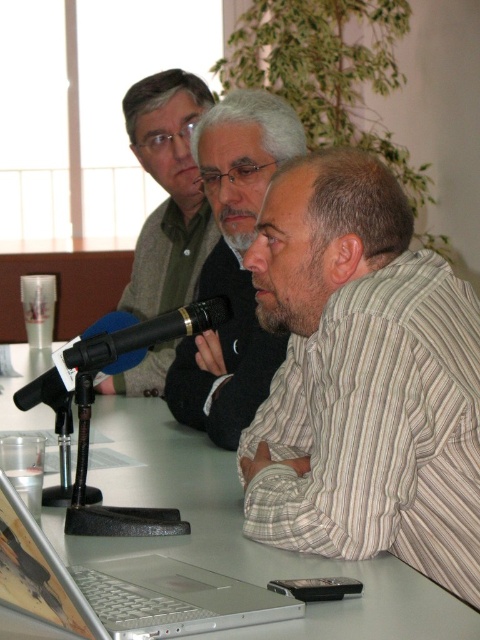
Based on the photo, you are standing at the entrance of the room and want to locate the striped cotton shirt at center. According to the coordinates provided, in which direction should you look relative to the center of the image?

The striped cotton shirt at center is located at coordinates point (362, 380). Since the center of the image is typically at (240, 320), the shirt is slightly to the right and above the center point.

You are a photographer trying to capture a closeup of the striped cotton shirt at center and the black matte microphone at center. Which object should you focus on first to ensure it appears sharp in the photo?

The striped cotton shirt at center is closer to the viewer than the black matte microphone at center, so you should focus on the striped cotton shirt at center first to ensure it appears sharp.

You are a photographer standing at the center of the room. You want to take a photo of the silver metallic laptop at lower left and ensure it is in focus while keeping the microphone in the background blurry. Can you achieve this with a camera that has a maximum depth of field of 28 inches?

The silver metallic laptop at lower left and the microphone are 28.51 inches apart. Since the depth of field is 28 inches, which is less than the distance between them, you can achieve the desired effect by focusing on the laptop, making the microphone blurry in the background.